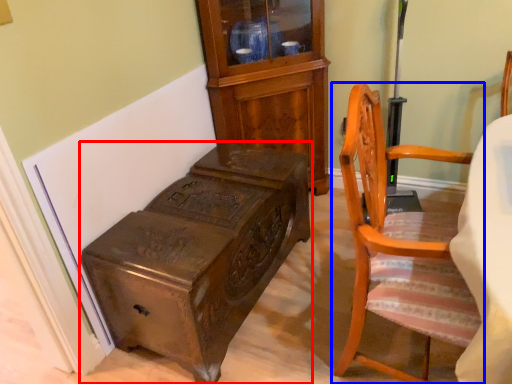
Question: Among these objects, which one is nearest to the camera, furniture (highlighted by a red box) or chair (highlighted by a blue box)?

Choices:
 (A) furniture
 (B) chair

Answer: (B)